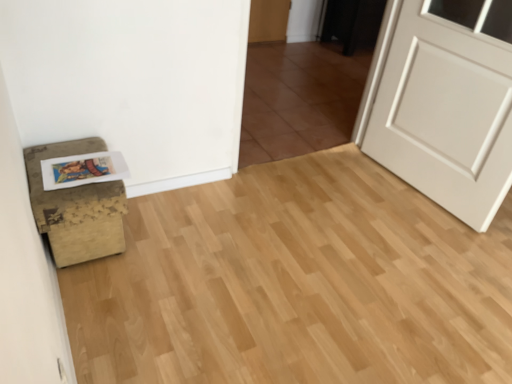
Question: Is matte paper postcard at lower left to the right of brown tile at center from the viewer's perspective?

Choices:
 (A) no
 (B) yes

Answer: (A)

Question: Is matte paper postcard at lower left outside brown tile at center?

Choices:
 (A) no
 (B) yes

Answer: (B)

Question: Can you confirm if matte paper postcard at lower left is smaller than brown tile at center?

Choices:
 (A) no
 (B) yes

Answer: (B)

Question: From a real-world perspective, is matte paper postcard at lower left located beneath brown tile at center?

Choices:
 (A) no
 (B) yes

Answer: (B)

Question: From a real-world perspective, is matte paper postcard at lower left over brown tile at center?

Choices:
 (A) yes
 (B) no

Answer: (B)

Question: Is matte paper postcard at lower left positioned with its back to brown tile at center?

Choices:
 (A) no
 (B) yes

Answer: (A)

Question: From the image's perspective, is matte paper postcard at lower left on top of distressed brown ottoman at lower left?

Choices:
 (A) yes
 (B) no

Answer: (A)

Question: Considering the relative sizes of matte paper postcard at lower left and distressed brown ottoman at lower left in the image provided, is matte paper postcard at lower left wider than distressed brown ottoman at lower left?

Choices:
 (A) no
 (B) yes

Answer: (A)

Question: Is matte paper postcard at lower left to the right of distressed brown ottoman at lower left from the viewer's perspective?

Choices:
 (A) yes
 (B) no

Answer: (A)

Question: Is matte paper postcard at lower left bigger than distressed brown ottoman at lower left?

Choices:
 (A) no
 (B) yes

Answer: (A)

Question: Can distressed brown ottoman at lower left be found inside matte paper postcard at lower left?

Choices:
 (A) no
 (B) yes

Answer: (A)

Question: Is matte paper postcard at lower left thinner than distressed brown ottoman at lower left?

Choices:
 (A) yes
 (B) no

Answer: (A)

Question: Is distressed brown ottoman at lower left at the left side of matte paper postcard at lower left?

Choices:
 (A) no
 (B) yes

Answer: (B)